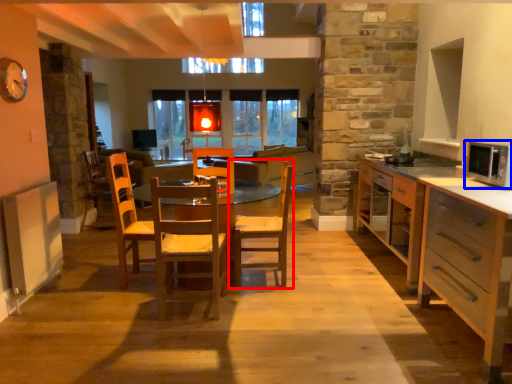
Question: Among these objects, which one is farthest to the camera, chair (highlighted by a red box) or microwave oven (highlighted by a blue box)?

Choices:
 (A) chair
 (B) microwave oven

Answer: (A)